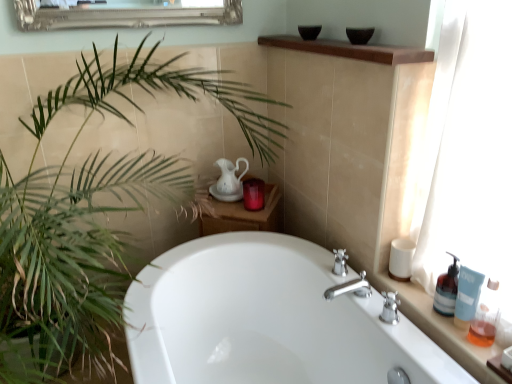
Find the location of a particular element. This screenshot has width=512, height=384. white matte cup at right, which is the 2th toiletry in right-to-left order is located at coordinates (401, 259).

The height and width of the screenshot is (384, 512). I want to click on white ceramic pitcher at center, so click(230, 176).

Image resolution: width=512 pixels, height=384 pixels. Identify the location of brown wood shelf at upper center, the second counter top in the bottom-to-top sequence. (350, 50).

What is the approximate width of white glossy bathtub at center?

The width of white glossy bathtub at center is 79.49 centimeters.

What do you see at coordinates (467, 296) in the screenshot?
I see `blue matte tube at right, which ranks as the 1th toiletry in bottom-to-top order` at bounding box center [467, 296].

This screenshot has height=384, width=512. I want to click on matte glass candle at upper center, the first toiletry when ordered from left to right, so point(254,194).

Identify the location of white matte cup at right, which is the second toiletry in back-to-front order. (401, 259).

Does point (455, 297) lie behind point (354, 50)?

Yes, point (455, 297) is behind point (354, 50).

Which of these two, translucent glass soap dispenser at right, the first soap dispenser positioned from the back, or brown wood shelf at upper center, acting as the 1th counter top starting from the top, stands taller?

translucent glass soap dispenser at right, the first soap dispenser positioned from the back.

Which object is closer to the camera, translucent glass soap dispenser at right, the first soap dispenser positioned from the back, or brown wood shelf at upper center, acting as the 1th counter top starting from the top?

brown wood shelf at upper center, acting as the 1th counter top starting from the top, is more forward.

Is translucent glass soap dispenser at right, the second soap dispenser positioned from the front, smaller than brown wood shelf at upper center, the 1th counter top in the left-to-right sequence?

Yes, translucent glass soap dispenser at right, the second soap dispenser positioned from the front, is smaller than brown wood shelf at upper center, the 1th counter top in the left-to-right sequence.

From the image's perspective, would you say translucent glass soap dispenser at right, the second soap dispenser positioned from the front, is positioned over white ceramic pitcher at center?

No, from the image's perspective, translucent glass soap dispenser at right, the second soap dispenser positioned from the front, is not over white ceramic pitcher at center.

Does translucent glass soap dispenser at right, the first soap dispenser positioned from the back, touch white ceramic pitcher at center?

translucent glass soap dispenser at right, the first soap dispenser positioned from the back, and white ceramic pitcher at center are clearly separated.

Would you say translucent glass soap dispenser at right, the first soap dispenser positioned from the back, is inside or outside white ceramic pitcher at center?

translucent glass soap dispenser at right, the first soap dispenser positioned from the back, cannot be found inside white ceramic pitcher at center.

Which is closer, (x=441, y=300) or (x=258, y=198)?

Point (x=441, y=300) is closer to the camera than point (x=258, y=198).

From the picture: Does translucent glass soap dispenser at right, the second soap dispenser positioned from the front, have a smaller size compared to matte glass candle at upper center, acting as the first toiletry starting from the back?

Correct, translucent glass soap dispenser at right, the second soap dispenser positioned from the front, occupies less space than matte glass candle at upper center, acting as the first toiletry starting from the back.

Between translucent glass soap dispenser at right, the second soap dispenser positioned from the front, and matte glass candle at upper center, the 3th toiletry viewed from the front, which one has more height?

translucent glass soap dispenser at right, the second soap dispenser positioned from the front, is taller.

From a real-world perspective, which object stands above the other?

translucent glass soap dispenser at right, the second soap dispenser positioned from the front, is physically above.

Is white glossy bathtub at center surrounding brown wood shelf at upper center, acting as the 1th counter top starting from the top?

No, brown wood shelf at upper center, acting as the 1th counter top starting from the top, is not surrounded by white glossy bathtub at center.

How different are the orientations of white glossy bathtub at center and brown wood shelf at upper center, the second counter top in the bottom-to-top sequence, in degrees?

The angle between the facing direction of white glossy bathtub at center and the facing direction of brown wood shelf at upper center, the second counter top in the bottom-to-top sequence, is 0.574 degrees.

From a real-world perspective, does white glossy bathtub at center sit lower than brown wood shelf at upper center, the 1th counter top in the left-to-right sequence?

Yes, from a real-world perspective, white glossy bathtub at center is under brown wood shelf at upper center, the 1th counter top in the left-to-right sequence.

Can you confirm if white glossy bathtub at center is wider than brown wood shelf at upper center, acting as the 1th counter top starting from the top?

Indeed, white glossy bathtub at center has a greater width compared to brown wood shelf at upper center, acting as the 1th counter top starting from the top.

From a real-world perspective, between translucent plastic bottles at right, which is the first counter top from right to left, and translucent glass soap dispenser at right, the first soap dispenser positioned from the back, who is vertically higher?

translucent glass soap dispenser at right, the first soap dispenser positioned from the back, from a real-world perspective.

Is translucent plastic bottles at right, the second counter top in the left-to-right sequence, thinner than translucent glass soap dispenser at right, the first soap dispenser positioned from the back?

No.

Which of these two, translucent plastic bottles at right, the second counter top in the left-to-right sequence, or translucent glass soap dispenser at right, the first soap dispenser positioned from the back, stands shorter?

translucent plastic bottles at right, the second counter top in the left-to-right sequence, is shorter.

Which is behind, matte glass candle at upper center, the 3th toiletry viewed from the front, or brown wood shelf at upper center, acting as the second counter top starting from the right?

matte glass candle at upper center, the 3th toiletry viewed from the front, is further away from the camera.

Is point (245, 194) closer to camera compared to point (350, 45)?

No.

Considering the sizes of objects matte glass candle at upper center, acting as the first toiletry starting from the back, and brown wood shelf at upper center, acting as the second counter top starting from the right, in the image provided, who is shorter, matte glass candle at upper center, acting as the first toiletry starting from the back, or brown wood shelf at upper center, acting as the second counter top starting from the right,?

With less height is brown wood shelf at upper center, acting as the second counter top starting from the right.

Considering the sizes of objects matte glass candle at upper center, the 1th toiletry in the top-to-bottom sequence, and brown wood shelf at upper center, the second counter top in the bottom-to-top sequence, in the image provided, who is thinner, matte glass candle at upper center, the 1th toiletry in the top-to-bottom sequence, or brown wood shelf at upper center, the second counter top in the bottom-to-top sequence,?

matte glass candle at upper center, the 1th toiletry in the top-to-bottom sequence, is thinner.

Is point (492, 319) farther from viewer compared to point (459, 298)?

No.

From the picture: Is blue matte tube at right, the third toiletry viewed from the left, located within translucent plastic soap dispenser at right, positioned as the second soap dispenser in back-to-front order?

No.

From the image's perspective, is translucent plastic soap dispenser at right, positioned as the second soap dispenser in back-to-front order, located above or below blue matte tube at right, the third toiletry from the back?

translucent plastic soap dispenser at right, positioned as the second soap dispenser in back-to-front order, is situated lower than blue matte tube at right, the third toiletry from the back, in the image.

From a real-world perspective, which is physically below, translucent plastic soap dispenser at right, which is the 1th soap dispenser in front-to-back order, or blue matte tube at right, which is counted as the 1th toiletry, starting from the front?

From a 3D spatial view, blue matte tube at right, which is counted as the 1th toiletry, starting from the front, is below.

Starting from the translucent glass soap dispenser at right, the first soap dispenser positioned from the back, which counter top is the 1st one in front? Please provide its 2D coordinates.

[(350, 50)]

Where is `soap dispenser that is the 1st one when counting downward from the white ceramic pitcher at center (from the image's perspective)`? This screenshot has width=512, height=384. soap dispenser that is the 1st one when counting downward from the white ceramic pitcher at center (from the image's perspective) is located at coordinates (447, 289).

Based on their spatial positions, is translucent plastic bottles at right, which is the first counter top from right to left, or translucent glass soap dispenser at right, the second soap dispenser positioned from the front, further from translucent plastic soap dispenser at right, which is the 1th soap dispenser in front-to-back order?

The object further to translucent plastic soap dispenser at right, which is the 1th soap dispenser in front-to-back order, is translucent plastic bottles at right, which is the first counter top from right to left.

When comparing their distances from translucent glass soap dispenser at right, the second soap dispenser positioned from the front, does white ceramic pitcher at center or translucent plastic soap dispenser at right, which is the 1th soap dispenser in front-to-back order, seem closer?

translucent plastic soap dispenser at right, which is the 1th soap dispenser in front-to-back order.

Based on their spatial positions, is brown wood shelf at upper center, the 1th counter top in the left-to-right sequence, or green leafy plant at left further from white matte cup at right, which is the second toiletry in back-to-front order?

The object further to white matte cup at right, which is the second toiletry in back-to-front order, is green leafy plant at left.

Looking at the image, which one is located closer to matte glass candle at upper center, the first toiletry when ordered from left to right, translucent plastic bottles at right, which is the first counter top from right to left, or green leafy plant at left?

The object closer to matte glass candle at upper center, the first toiletry when ordered from left to right, is green leafy plant at left.

Which object lies further to the anchor point white matte cup at right, which is the second toiletry in back-to-front order, green leafy plant at left or matte glass candle at upper center, the 3th toiletry viewed from the front?

The object further to white matte cup at right, which is the second toiletry in back-to-front order, is green leafy plant at left.

Based on their spatial positions, is translucent plastic soap dispenser at right, which is the 1th soap dispenser in front-to-back order, or brown wood shelf at upper center, acting as the 1th counter top starting from the top, closer to translucent plastic bottles at right, which is the first counter top from right to left?

Among the two, translucent plastic soap dispenser at right, which is the 1th soap dispenser in front-to-back order, is located nearer to translucent plastic bottles at right, which is the first counter top from right to left.

Estimate the real-world distances between objects in this image. Which object is further from translucent plastic bottles at right, marked as the first counter top in a bottom-to-top arrangement, translucent glass soap dispenser at right, the second soap dispenser positioned from the front, or green leafy plant at left?

green leafy plant at left.

Estimate the real-world distances between objects in this image. Which object is closer to blue matte tube at right, which is counted as the 1th toiletry, starting from the front, matte glass candle at upper center, the third toiletry ordered from the bottom, or translucent glass soap dispenser at right, the second soap dispenser positioned from the front?

translucent glass soap dispenser at right, the second soap dispenser positioned from the front.

You are a GUI agent. You are given a task and a screenshot of the screen. Output one action in this format:
    pyautogui.click(x=<x>, y=<y>)
    Task: Click on the bathtub between green leafy plant at left and white matte cup at right, positioned as the second toiletry in bottom-to-top order
    
    Given the screenshot: What is the action you would take?
    pyautogui.click(x=266, y=319)

Where is `soap dispenser located between translucent plastic soap dispenser at right, positioned as the second soap dispenser in back-to-front order, and matte glass candle at upper center, the first toiletry when ordered from left to right, in the depth direction`? The image size is (512, 384). soap dispenser located between translucent plastic soap dispenser at right, positioned as the second soap dispenser in back-to-front order, and matte glass candle at upper center, the first toiletry when ordered from left to right, in the depth direction is located at coordinates (447, 289).

Find the location of a particular element. toiletry positioned between translucent plastic soap dispenser at right, positioned as the second soap dispenser in back-to-front order, and translucent glass soap dispenser at right, the second soap dispenser positioned from the front, from near to far is located at coordinates (467, 296).

Where is `toiletry between translucent glass soap dispenser at right, the first soap dispenser positioned from the back, and matte glass candle at upper center, the third toiletry ordered from the bottom, in the front-back direction`? The width and height of the screenshot is (512, 384). toiletry between translucent glass soap dispenser at right, the first soap dispenser positioned from the back, and matte glass candle at upper center, the third toiletry ordered from the bottom, in the front-back direction is located at coordinates click(401, 259).